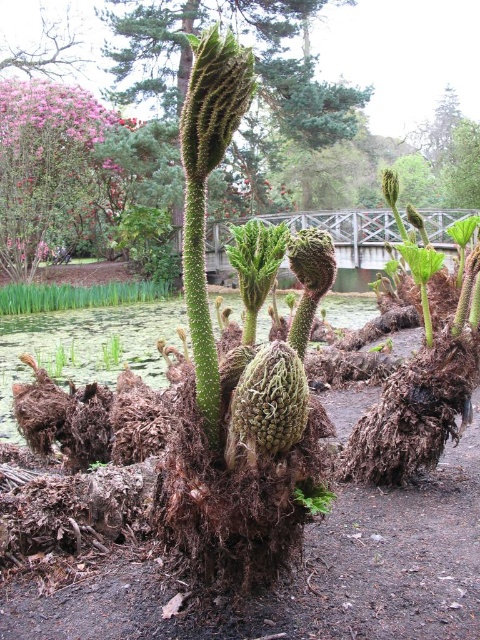
You are a gardener who needs to water both the green fuzzy plant at center and the pink fluffy flower at upper left. Your watering can has a range of 3 meters. Can you reach both plants from your current position without moving closer?

The distance between the green fuzzy plant at center and the pink fluffy flower at upper left is 3.42 meters. Since your watering can only reaches 3 meters, you cannot water both plants without moving closer.

Looking at this image, you are standing in the garden and want to walk from the wooden bridge to the pond. You notice two points marked in the scene. Which point, point (310, 125) or point (87, 99), is closer to your current position on the wooden bridge?

Point (310, 125) is further to the viewer than point (87, 99), so the point closer to your current position on the wooden bridge is point (87, 99).